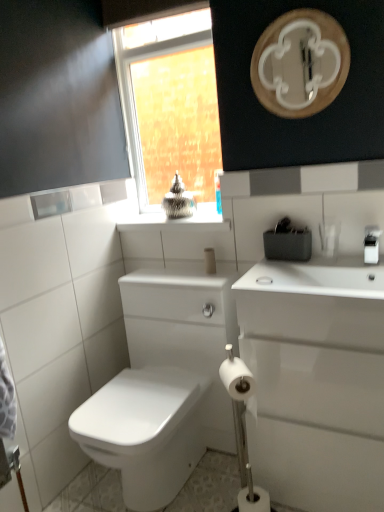
Question: From a real-world perspective, is white glossy mirror at upper center over white matte toilet paper at lower center, arranged as the 2th toilet paper when ordered from the bottom?

Choices:
 (A) no
 (B) yes

Answer: (B)

Question: Considering the relative sizes of white glossy mirror at upper center and white matte toilet paper at lower center, arranged as the 2th toilet paper when ordered from the bottom, in the image provided, is white glossy mirror at upper center bigger than white matte toilet paper at lower center, arranged as the 2th toilet paper when ordered from the bottom,?

Choices:
 (A) yes
 (B) no

Answer: (A)

Question: Could you tell me if white glossy mirror at upper center is turned towards white matte toilet paper at lower center, which is counted as the 1th toilet paper, starting from the top?

Choices:
 (A) no
 (B) yes

Answer: (A)

Question: Can you confirm if white glossy mirror at upper center is positioned to the left of white matte toilet paper at lower center, arranged as the 2th toilet paper when ordered from the bottom?

Choices:
 (A) yes
 (B) no

Answer: (B)

Question: Is white glossy mirror at upper center completely or partially outside of white matte toilet paper at lower center, which is counted as the 1th toilet paper, starting from the top?

Choices:
 (A) no
 (B) yes

Answer: (B)

Question: Is white matte toilet paper at lower center, which is counted as the 1th toilet paper, starting from the top, surrounded by white glossy mirror at upper center?

Choices:
 (A) no
 (B) yes

Answer: (A)

Question: Is white matte toilet paper at lower center, the 2th toilet paper from the top, at the back of white glossy mirror at upper center?

Choices:
 (A) yes
 (B) no

Answer: (B)

Question: Is white glossy mirror at upper center touching white matte toilet paper at lower center, which is the first toilet paper in bottom-to-top order?

Choices:
 (A) yes
 (B) no

Answer: (B)

Question: From a real-world perspective, is white glossy mirror at upper center under white matte toilet paper at lower center, the 2th toilet paper from the top?

Choices:
 (A) yes
 (B) no

Answer: (B)

Question: Considering the relative sizes of white glossy mirror at upper center and white matte toilet paper at lower center, the 2th toilet paper from the top, in the image provided, is white glossy mirror at upper center smaller than white matte toilet paper at lower center, the 2th toilet paper from the top,?

Choices:
 (A) yes
 (B) no

Answer: (B)

Question: Considering the relative positions of white glossy mirror at upper center and white matte toilet paper at lower center, the 2th toilet paper from the top, in the image provided, is white glossy mirror at upper center in front of white matte toilet paper at lower center, the 2th toilet paper from the top,?

Choices:
 (A) no
 (B) yes

Answer: (B)

Question: Can you confirm if white glossy mirror at upper center is shorter than white matte toilet paper at lower center, which is the first toilet paper in bottom-to-top order?

Choices:
 (A) yes
 (B) no

Answer: (B)

Question: Considering the relative sizes of white matte toilet paper at lower center, which is counted as the 1th toilet paper, starting from the top, and clear glass window at upper center in the image provided, is white matte toilet paper at lower center, which is counted as the 1th toilet paper, starting from the top, taller than clear glass window at upper center?

Choices:
 (A) yes
 (B) no

Answer: (B)